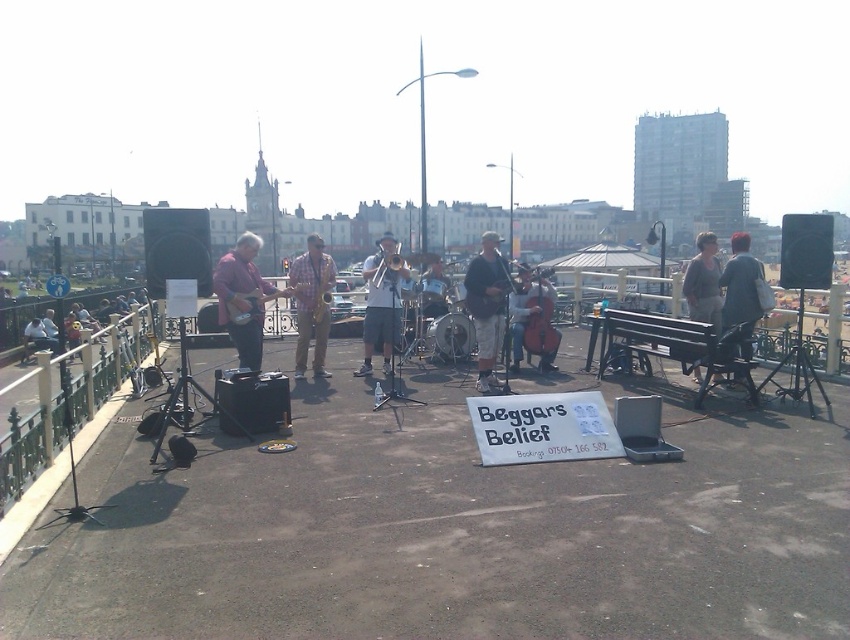
Measure the distance from matte black cello at center to brushed metal saxophone at center.

A distance of 6.98 feet exists between matte black cello at center and brushed metal saxophone at center.

Looking at this image, can you confirm if matte black cello at center is positioned to the right of brushed metal saxophone at center?

Correct, you'll find matte black cello at center to the right of brushed metal saxophone at center.

Between point (548, 324) and point (384, 280), which one is positioned behind?

The point (548, 324) is behind.

Locate an element on the screen. The width and height of the screenshot is (850, 640). matte black cello at center is located at coordinates (540, 321).

Who is lower down, matte black trombone at center or denim jacket at right?

denim jacket at right is lower down.

Is matte black trombone at center in front of denim jacket at right?

No, matte black trombone at center is further to the viewer.

Which is behind, point (374, 340) or point (748, 349)?

Positioned behind is point (374, 340).

Identify the location of matte black trombone at center. (381, 304).

Can you confirm if matte black guitar at center is wider than matte black trombone at center?

No.

Does matte black guitar at center have a smaller size compared to matte black trombone at center?

Correct, matte black guitar at center occupies less space than matte black trombone at center.

Image resolution: width=850 pixels, height=640 pixels. What do you see at coordinates (486, 307) in the screenshot?
I see `matte black guitar at center` at bounding box center [486, 307].

The height and width of the screenshot is (640, 850). I want to click on matte black guitar at center, so click(x=486, y=307).